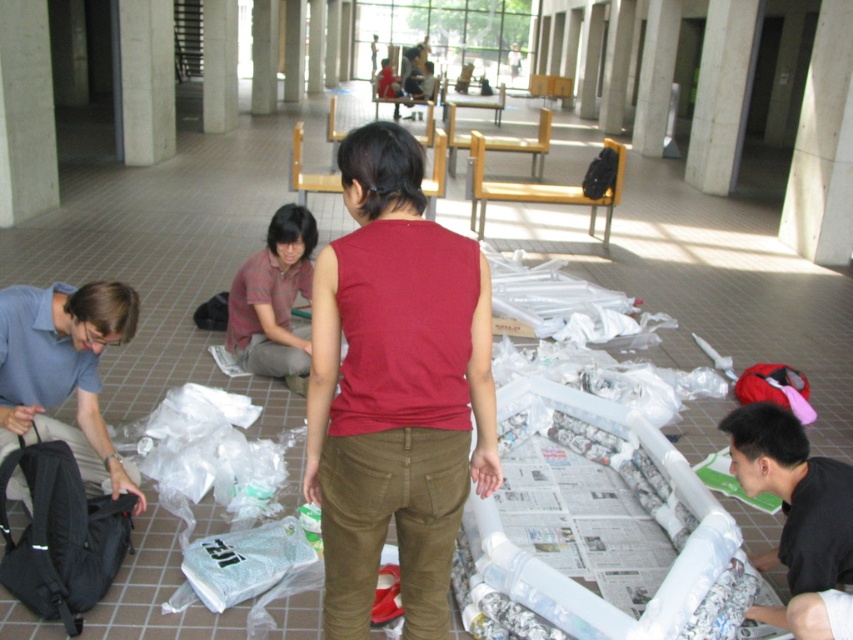
Which is above, concrete at left or striped cotton shirt at center?

concrete at left is above.

Can you confirm if concrete at left is bigger than striped cotton shirt at center?

Yes, concrete at left is bigger than striped cotton shirt at center.

This screenshot has width=853, height=640. I want to click on concrete at left, so click(25, 113).

At what (x,y) coordinates should I click in order to perform the action: click on concrete at left. Please return your answer as a coordinate pair (x, y). Image resolution: width=853 pixels, height=640 pixels. Looking at the image, I should click on (25, 113).

In the scene shown: Who is more distant from viewer, (202, 108) or (798, 406)?

Point (202, 108)

This screenshot has width=853, height=640. Identify the location of white concrete pillar at upper center. (219, 65).

This screenshot has height=640, width=853. Describe the element at coordinates (219, 65) in the screenshot. I see `white concrete pillar at upper center` at that location.

At what (x,y) coordinates should I click in order to perform the action: click on white concrete pillar at upper center. Please return your answer as a coordinate pair (x, y). Image resolution: width=853 pixels, height=640 pixels. Looking at the image, I should click on (219, 65).

Does matte red sleeveless shirt at center appear on the right side of white marble pillar at center?

No, matte red sleeveless shirt at center is not to the right of white marble pillar at center.

Measure the distance between matte red sleeveless shirt at center and camera.

matte red sleeveless shirt at center and camera are 1.74 meters apart from each other.

At what (x,y) coordinates should I click in order to perform the action: click on matte red sleeveless shirt at center. Please return your answer as a coordinate pair (x, y). The height and width of the screenshot is (640, 853). Looking at the image, I should click on (395, 388).